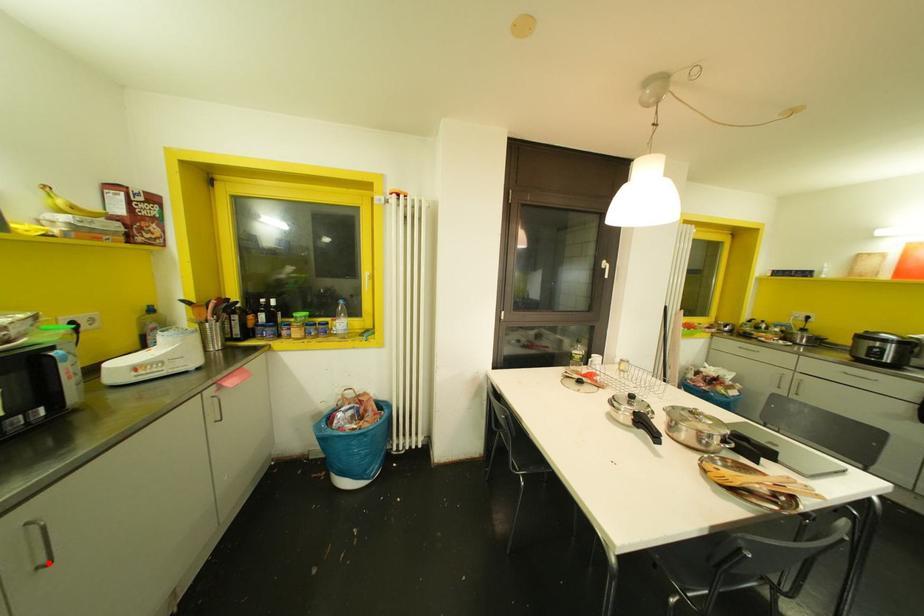
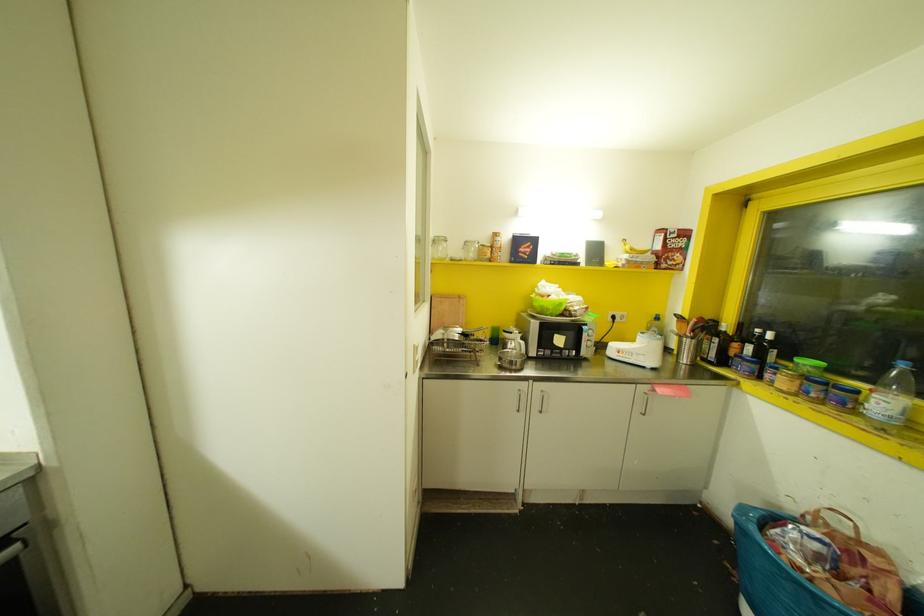
Where in the second image is the point corresponding to the highlighted location from the first image?

(541, 411)